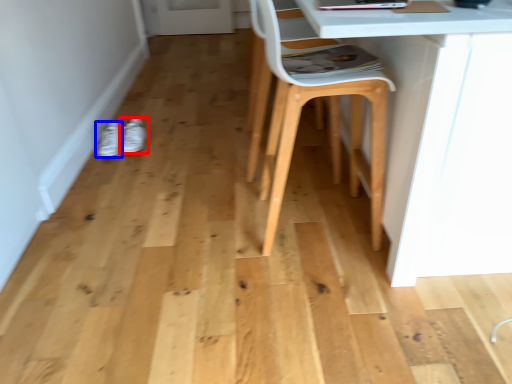
Question: Which of the following is the closest to the observer, footwear (highlighted by a red box) or footwear (highlighted by a blue box)?

Choices:
 (A) footwear
 (B) footwear

Answer: (B)